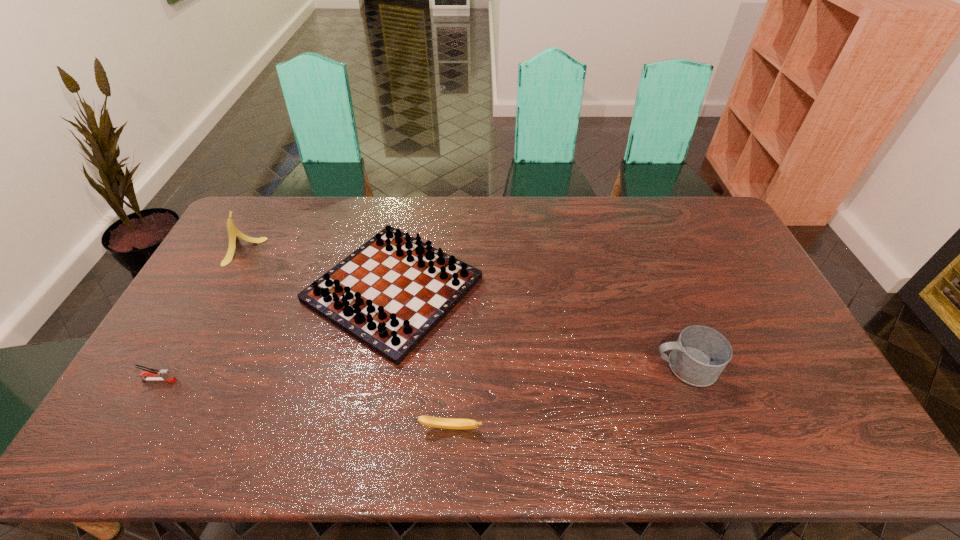
This screenshot has height=540, width=960. In the image, there is a desktop. Identify the location of vacant space at the near edge. (723, 443).

Find the location of a particular element. vacant area at the left edge is located at coordinates (193, 333).

Find the location of a particular element. vacant space at the right edge is located at coordinates (704, 249).

This screenshot has height=540, width=960. Find the location of `free space at the near right corner of the desktop`. free space at the near right corner of the desktop is located at coordinates (860, 446).

You are a GUI agent. You are given a task and a screenshot of the screen. Output one action in this format:
    pyautogui.click(x=<x>, y=<y>)
    Task: Click on the vacant space in between the second shortest object and the chessboard
    
    Given the screenshot: What is the action you would take?
    pyautogui.click(x=276, y=334)

I want to click on free space that is in between the rightmost object and the stapler, so click(421, 373).

The height and width of the screenshot is (540, 960). I want to click on free point between the left banana and the stapler, so click(x=201, y=315).

This screenshot has height=540, width=960. I want to click on vacant space that's between the left banana and the chessboard, so click(318, 269).

Where is `vacant point located between the left banana and the nearest object`? This screenshot has width=960, height=540. vacant point located between the left banana and the nearest object is located at coordinates tap(346, 339).

I want to click on vacant area between the farther banana and the shorter banana, so click(x=346, y=339).